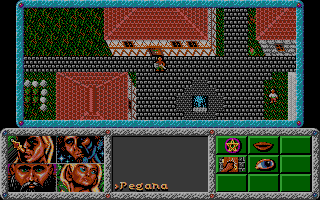
Identify the location of empty boxes. Image resolution: width=320 pixels, height=200 pixels. (296, 141), (297, 164), (296, 178), (257, 183), (238, 185).